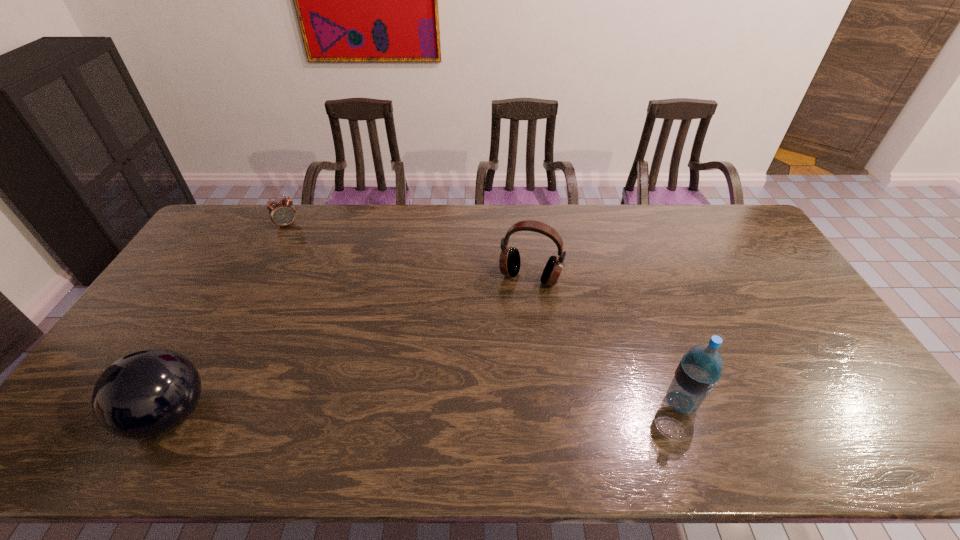
This screenshot has height=540, width=960. Identify the location of free spot on the desktop that is between the bowling ball and the water bottle and is positioned on the ear pads of the third object from left to right. 483,408.

Locate an element on the screen. The height and width of the screenshot is (540, 960). vacant space on the desktop that is between the bowling ball and the water bottle and is positioned on the face of the farthest object is located at coordinates (352, 411).